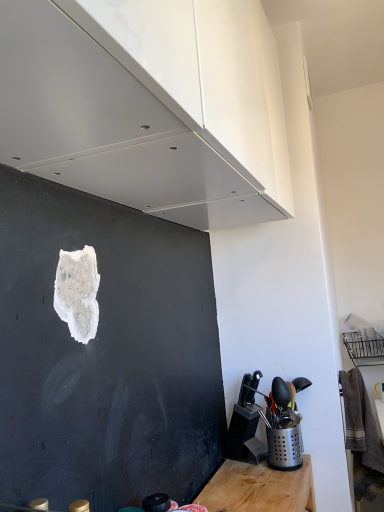
What is the approximate width of silver perforated utensil holder at lower right?

silver perforated utensil holder at lower right is 4.85 inches in width.

Find the location of `silver perforated utensil holder at lower right`. silver perforated utensil holder at lower right is located at coordinates (285, 446).

What do you see at coordinates (285, 446) in the screenshot?
I see `silver perforated utensil holder at lower right` at bounding box center [285, 446].

In order to face white glossy cabinet at upper center, should I rotate leftwards or rightwards?

Rotate your view left by about 2.532°.

Identify the location of white glossy cabinet at upper center. (149, 105).

Image resolution: width=384 pixels, height=512 pixels. What do you see at coordinates (149, 105) in the screenshot?
I see `white glossy cabinet at upper center` at bounding box center [149, 105].

Locate an element on the screen. silver perforated utensil holder at lower right is located at coordinates (285, 446).

Does silver perforated utensil holder at lower right appear on the left side of white glossy cabinet at upper center?

In fact, silver perforated utensil holder at lower right is to the right of white glossy cabinet at upper center.

Between silver perforated utensil holder at lower right and white glossy cabinet at upper center, which one is positioned behind?

silver perforated utensil holder at lower right is more distant.

Is point (292, 438) less distant than point (104, 130)?

No.

From the image's perspective, is silver perforated utensil holder at lower right below white glossy cabinet at upper center?

Correct, silver perforated utensil holder at lower right appears lower than white glossy cabinet at upper center in the image.

From a real-world perspective, who is located higher, silver perforated utensil holder at lower right or white glossy cabinet at upper center?

In real-world perspective, white glossy cabinet at upper center is above.

Is silver perforated utensil holder at lower right wider than white glossy cabinet at upper center?

No, silver perforated utensil holder at lower right is not wider than white glossy cabinet at upper center.

Can you confirm if silver perforated utensil holder at lower right is shorter than white glossy cabinet at upper center?

Correct, silver perforated utensil holder at lower right is not as tall as white glossy cabinet at upper center.

Is silver perforated utensil holder at lower right smaller than white glossy cabinet at upper center?

Yes.

Is silver perforated utensil holder at lower right inside the boundaries of white glossy cabinet at upper center, or outside?

silver perforated utensil holder at lower right lies outside white glossy cabinet at upper center.

Is silver perforated utensil holder at lower right next to white glossy cabinet at upper center and touching it?

There is a gap between silver perforated utensil holder at lower right and white glossy cabinet at upper center.

Is silver perforated utensil holder at lower right aimed at white glossy cabinet at upper center?

No, silver perforated utensil holder at lower right is not facing towards white glossy cabinet at upper center.

Can you tell me how much silver perforated utensil holder at lower right and white glossy cabinet at upper center differ in facing direction?

3.07 degrees separate the facing orientations of silver perforated utensil holder at lower right and white glossy cabinet at upper center.

You are a GUI agent. You are given a task and a screenshot of the screen. Output one action in this format:
    pyautogui.click(x=<x>, y=<y>)
    Task: Click on the appliance located on the right of white glossy cabinet at upper center
    This screenshot has width=384, height=512.
    Given the screenshot: What is the action you would take?
    pyautogui.click(x=285, y=446)

Is white glossy cabinet at upper center to the left of silver perforated utensil holder at lower right from the viewer's perspective?

Yes.

Is the position of white glossy cabinet at upper center more distant than that of silver perforated utensil holder at lower right?

No, white glossy cabinet at upper center is in front of silver perforated utensil holder at lower right.

Which is nearer, (38,62) or (269,453)?

The point (38,62) is closer to the camera.

From the image's perspective, which object appears higher, white glossy cabinet at upper center or silver perforated utensil holder at lower right?

From the image's view, white glossy cabinet at upper center is above.

From a real-world perspective, which is physically below, white glossy cabinet at upper center or silver perforated utensil holder at lower right?

silver perforated utensil holder at lower right.

Between white glossy cabinet at upper center and silver perforated utensil holder at lower right, which one has smaller width?

With smaller width is silver perforated utensil holder at lower right.

Considering the sizes of objects white glossy cabinet at upper center and silver perforated utensil holder at lower right in the image provided, who is shorter, white glossy cabinet at upper center or silver perforated utensil holder at lower right?

silver perforated utensil holder at lower right.

Who is bigger, white glossy cabinet at upper center or silver perforated utensil holder at lower right?

white glossy cabinet at upper center is bigger.

Is white glossy cabinet at upper center not within silver perforated utensil holder at lower right?

white glossy cabinet at upper center lies outside silver perforated utensil holder at lower right's area.

Are white glossy cabinet at upper center and silver perforated utensil holder at lower right beside each other?

There is a gap between white glossy cabinet at upper center and silver perforated utensil holder at lower right.

Looking at this image, is white glossy cabinet at upper center oriented towards silver perforated utensil holder at lower right?

No, white glossy cabinet at upper center is not facing towards silver perforated utensil holder at lower right.

How many degrees apart are the facing directions of white glossy cabinet at upper center and silver perforated utensil holder at lower right?

There is a 3.07-degree angle between the facing directions of white glossy cabinet at upper center and silver perforated utensil holder at lower right.

Where is `cabinetry on the left of silver perforated utensil holder at lower right`? The image size is (384, 512). cabinetry on the left of silver perforated utensil holder at lower right is located at coordinates (149, 105).

Locate an element on the screen. The image size is (384, 512). cabinetry on the left of the silver perforated utensil holder at lower right is located at coordinates (149, 105).

Find the location of a particular element. The width and height of the screenshot is (384, 512). appliance located below the white glossy cabinet at upper center (from the image's perspective) is located at coordinates (285, 446).